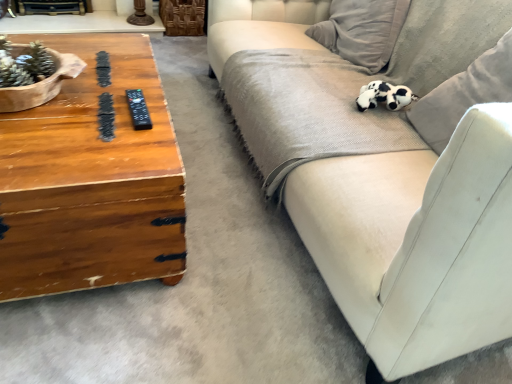
At what (x,y) coordinates should I click in order to perform the action: click on vacant space positioned to the left of black plastic remote at left. Please return your answer as a coordinate pair (x, y). Looking at the image, I should click on (86, 102).